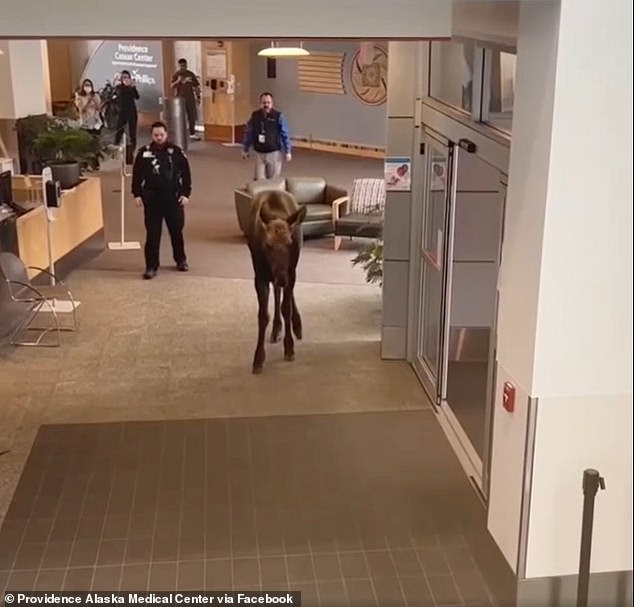
The width and height of the screenshot is (634, 607). Find the location of `grey tiles`. grey tiles is located at coordinates (299, 534).